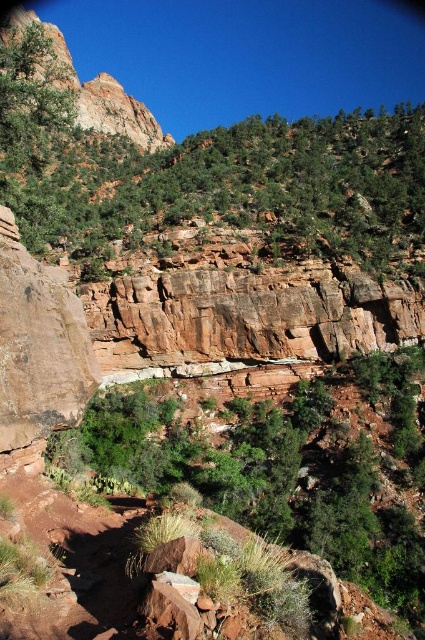
You are standing at the base of the cliff and looking up. There is a point marked at coordinates (226, 184). Based on the scene, where is this point located?

The point at (226, 184) is on green leafy trees at upper center.

You are standing in the valley below the cliff and want to take a photo of both the green leafy shrubs at center and the rustic rock formation at upper left. Which object should you focus on first to ensure both are in clear view?

You should focus on the green leafy shrubs at center first since it is closer to you than the rustic rock formation at upper left, so adjusting focus from near to far will help capture both clearly.

You are a hiker standing at the base of the cliff and want to reach the green leafy trees at upper center. Based on the distance provided, can you estimate how long it would take to walk there if your average walking speed is 3 miles per hour?

The distance to the green leafy trees at upper center is 172.73 feet. Converting that to miles, it is approximately 0.0326 miles. At a walking speed of 3 mph, it would take roughly 0.65 minutes or about 39 seconds to reach them.